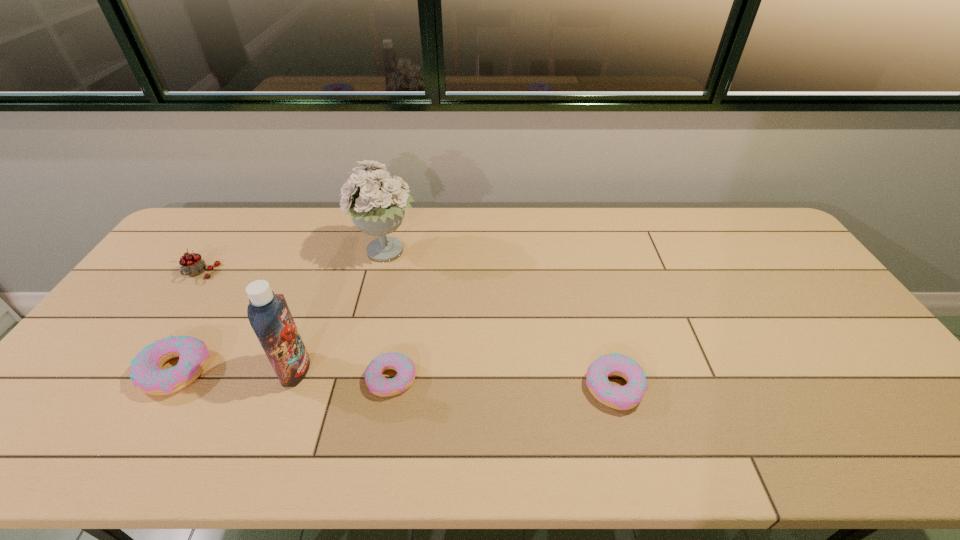
The height and width of the screenshot is (540, 960). In order to click on the leftmost doughnut in this screenshot , I will do `click(146, 374)`.

Image resolution: width=960 pixels, height=540 pixels. I want to click on the shortest doughnut, so click(379, 385).

You are a GUI agent. You are given a task and a screenshot of the screen. Output one action in this format:
    pyautogui.click(x=<x>, y=<y>)
    Task: Click on the shortest object
    This screenshot has width=960, height=540.
    Given the screenshot: What is the action you would take?
    pyautogui.click(x=379, y=385)

Locate an element on the screen. the rightmost object is located at coordinates (626, 397).

You are a GUI agent. You are given a task and a screenshot of the screen. Output one action in this format:
    pyautogui.click(x=<x>, y=<y>)
    Task: Click on the second shortest doughnut
    
    Given the screenshot: What is the action you would take?
    pyautogui.click(x=626, y=397)

This screenshot has width=960, height=540. Find the location of `bouquet`. bouquet is located at coordinates (377, 206).

The width and height of the screenshot is (960, 540). What are the coordinates of `cherry` in the screenshot? It's located at (192, 264).

Where is `the fourth object from right to left`? Image resolution: width=960 pixels, height=540 pixels. the fourth object from right to left is located at coordinates (268, 313).

Find the location of `shampoo`. shampoo is located at coordinates (268, 313).

Locate an element on the screen. free space located on the back of the leftmost doughnut is located at coordinates (224, 290).